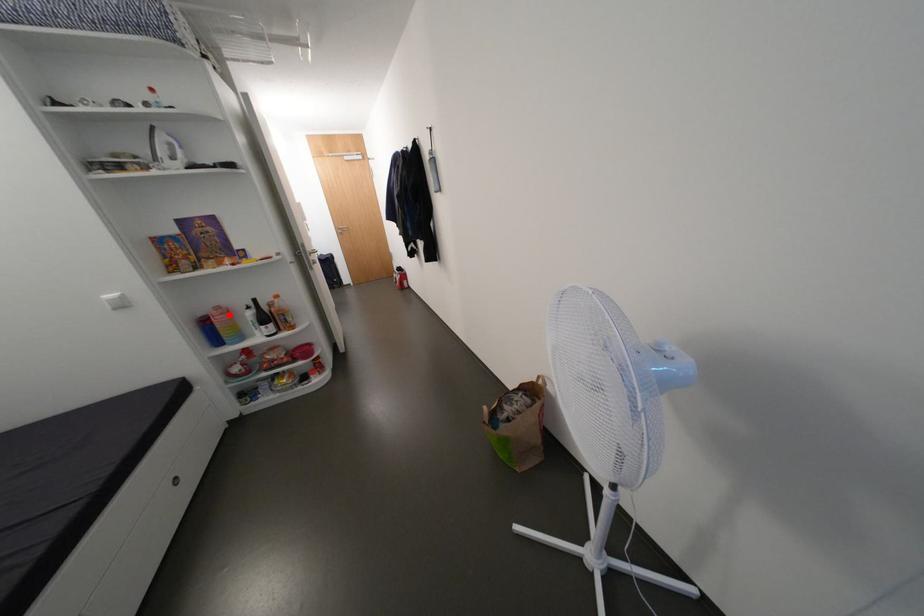
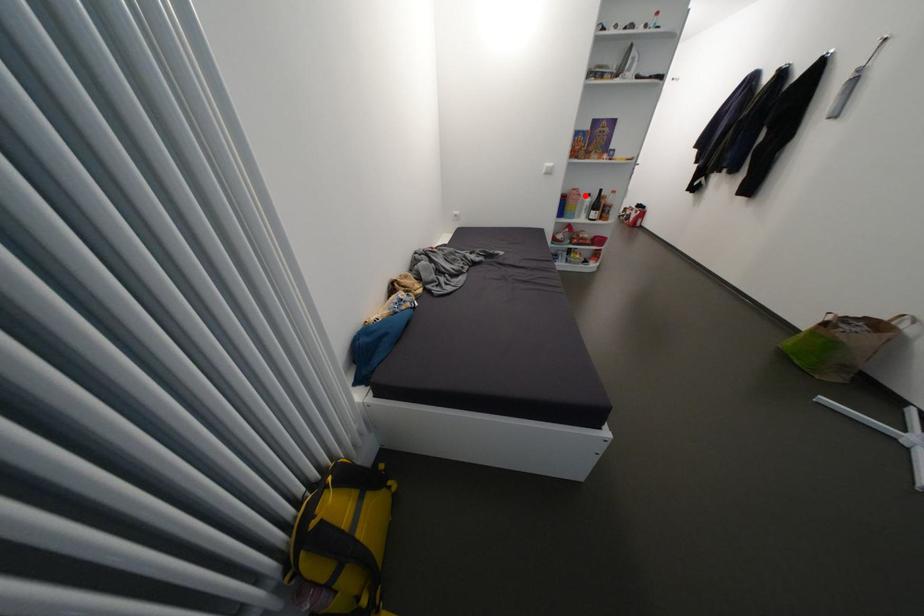
I am providing you with two images of the same scene from different viewpoints. A red point is marked on the first image and another point is marked on the second image. Are the points marked in image1 and image2 representing the same 3D position?

Yes